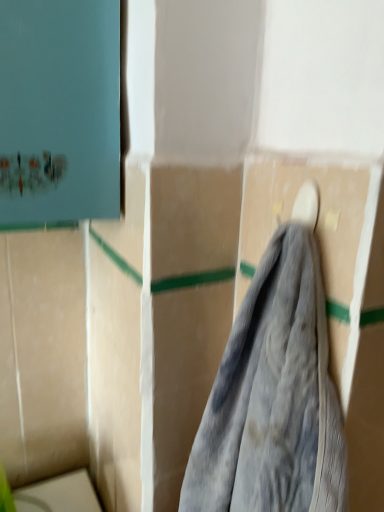
What do you see at coordinates (273, 398) in the screenshot? The width and height of the screenshot is (384, 512). I see `gray fabric towel at center` at bounding box center [273, 398].

The width and height of the screenshot is (384, 512). In order to click on gray fabric towel at center in this screenshot , I will do `click(273, 398)`.

What is the approximate width of gray fabric towel at center?

The width of gray fabric towel at center is 4.30 inches.

Find the location of a particular element. gray fabric towel at center is located at coordinates (273, 398).